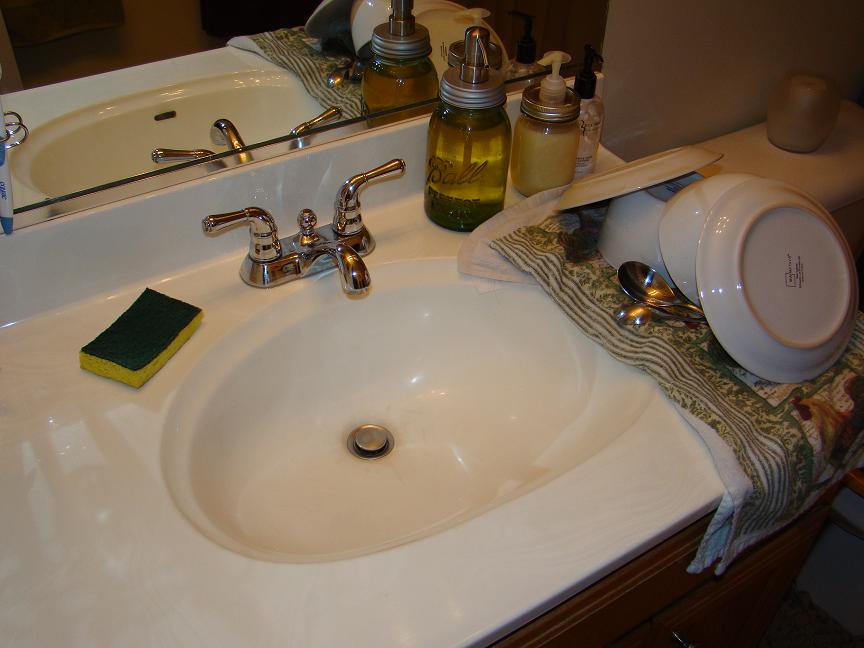
Image resolution: width=864 pixels, height=648 pixels. In order to click on sponge in this screenshot , I will do `click(122, 312)`.